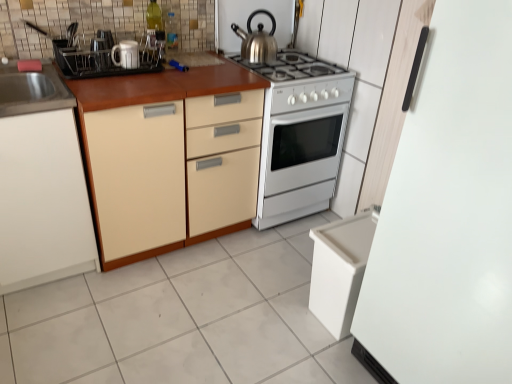
Question: From a real-world perspective, is transparent plastic bottle at upper center on white glossy tile at lower center?

Choices:
 (A) no
 (B) yes

Answer: (B)

Question: Does transparent plastic bottle at upper center come behind white glossy tile at lower center?

Choices:
 (A) no
 (B) yes

Answer: (B)

Question: Is transparent plastic bottle at upper center bigger than white glossy tile at lower center?

Choices:
 (A) yes
 (B) no

Answer: (B)

Question: Can you confirm if transparent plastic bottle at upper center is positioned to the right of white glossy tile at lower center?

Choices:
 (A) yes
 (B) no

Answer: (B)

Question: Can you confirm if transparent plastic bottle at upper center is positioned to the left of white glossy tile at lower center?

Choices:
 (A) no
 (B) yes

Answer: (B)

Question: Does transparent plastic bottle at upper center have a greater width compared to white glossy tile at lower center?

Choices:
 (A) yes
 (B) no

Answer: (B)

Question: Considering the relative positions of polished stainless steel kettle at upper center and white glossy oven at center, marked as the second appliance in a right-to-left arrangement, in the image provided, is polished stainless steel kettle at upper center to the right of white glossy oven at center, marked as the second appliance in a right-to-left arrangement, from the viewer's perspective?

Choices:
 (A) no
 (B) yes

Answer: (A)

Question: From the image's perspective, is polished stainless steel kettle at upper center on top of white glossy oven at center, which ranks as the 4th appliance in front-to-back order?

Choices:
 (A) yes
 (B) no

Answer: (A)

Question: Can white glossy oven at center, placed as the third appliance when sorted from left to right, be found inside polished stainless steel kettle at upper center?

Choices:
 (A) yes
 (B) no

Answer: (B)

Question: Is polished stainless steel kettle at upper center wider than white glossy oven at center, placed as the third appliance when sorted from left to right?

Choices:
 (A) no
 (B) yes

Answer: (A)

Question: Considering the relative sizes of polished stainless steel kettle at upper center and white glossy oven at center, which ranks as the 4th appliance in front-to-back order, in the image provided, is polished stainless steel kettle at upper center bigger than white glossy oven at center, which ranks as the 4th appliance in front-to-back order,?

Choices:
 (A) no
 (B) yes

Answer: (A)

Question: Does polished stainless steel kettle at upper center come behind white glossy oven at center, marked as the second appliance in a right-to-left arrangement?

Choices:
 (A) yes
 (B) no

Answer: (A)

Question: Is white glossy mug at upper left, marked as the 2th appliance in a back-to-front arrangement, further to the viewer compared to white plastic dishwasher at lower right?

Choices:
 (A) no
 (B) yes

Answer: (B)